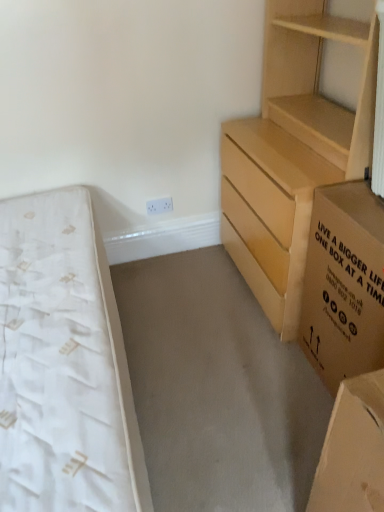
Question: Is white textured mattress at left bigger or smaller than light brown wooden chest of drawers at right?

Choices:
 (A) big
 (B) small

Answer: (B)

Question: Is point (122, 471) positioned closer to the camera than point (291, 320)?

Choices:
 (A) farther
 (B) closer

Answer: (B)

Question: Which object is positioned farthest from the white textured mattress at left?

Choices:
 (A) light brown wooden chest of drawers at right
 (B) brown cardboard box at right

Answer: (A)

Question: Which of these objects is positioned closest to the white textured mattress at left?

Choices:
 (A) light brown wooden chest of drawers at right
 (B) brown cardboard box at right

Answer: (B)